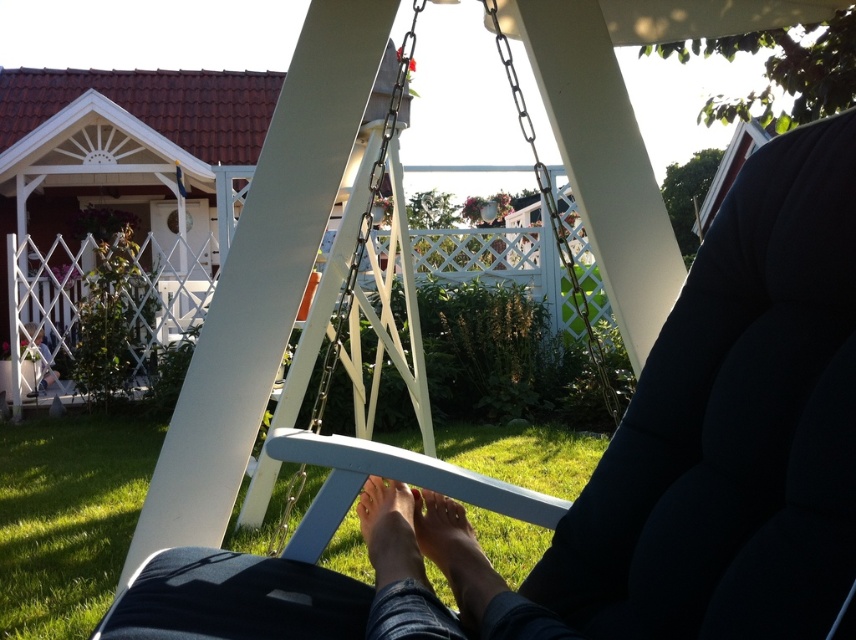
Based on the photo, which is more to the left, white matte swing at center or smooth skin foot at center?

white matte swing at center is more to the left.

Is white matte swing at center bigger than smooth skin foot at center?

Correct, white matte swing at center is larger in size than smooth skin foot at center.

Does point (345, 310) lie in front of point (391, 557)?

No, it is not.

Image resolution: width=856 pixels, height=640 pixels. Find the location of `white matte swing at center`. white matte swing at center is located at coordinates (366, 220).

Does white painted wood swing at center appear on the right side of matte white vase at lower left?

Yes, white painted wood swing at center is to the right of matte white vase at lower left.

Who is more forward, (421, 3) or (21, 332)?

Positioned in front is point (421, 3).

This screenshot has width=856, height=640. Find the location of `white painted wood swing at center`. white painted wood swing at center is located at coordinates (366, 220).

Locate an element on the screen. This screenshot has width=856, height=640. white painted wood swing at center is located at coordinates (366, 220).

Does point (828, 120) lie behind point (28, 323)?

No, (828, 120) is closer to viewer.

Describe the element at coordinates (646, 465) in the screenshot. I see `matte black cushion at center` at that location.

Where is `matte black cushion at center`? The image size is (856, 640). matte black cushion at center is located at coordinates (646, 465).

Locate an element on the screen. matte black cushion at center is located at coordinates (646, 465).